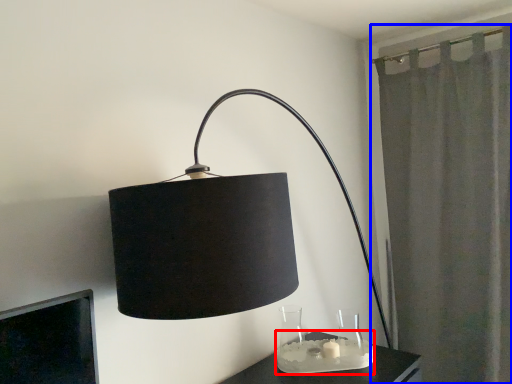
Question: Which of the following is the farthest to the observer, candle holder (highlighted by a red box) or curtain (highlighted by a blue box)?

Choices:
 (A) candle holder
 (B) curtain

Answer: (B)